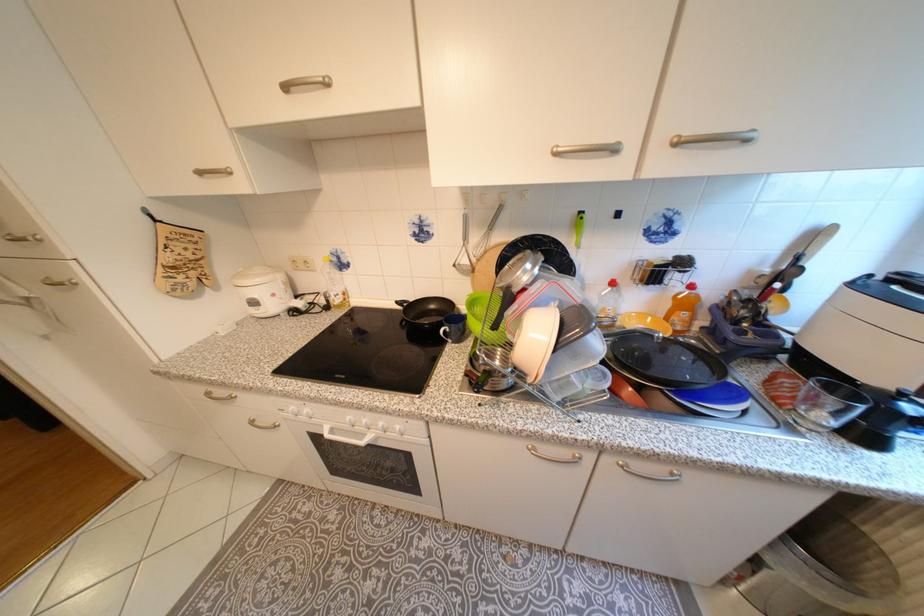
The height and width of the screenshot is (616, 924). What are the coordinates of `black pan handle` in the screenshot? It's located at (736, 349).